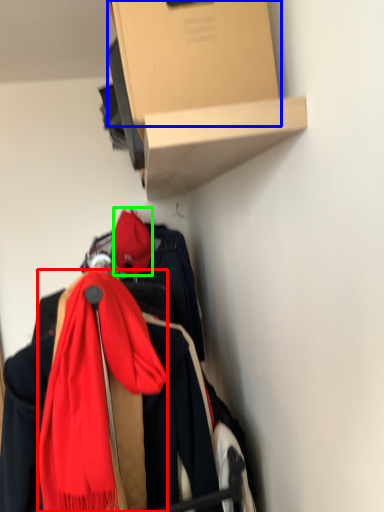
Question: Which is farther away from scarf (highlighted by a red box)? cardboard box (highlighted by a blue box) or hat (highlighted by a green box)?

Choices:
 (A) cardboard box
 (B) hat

Answer: (B)